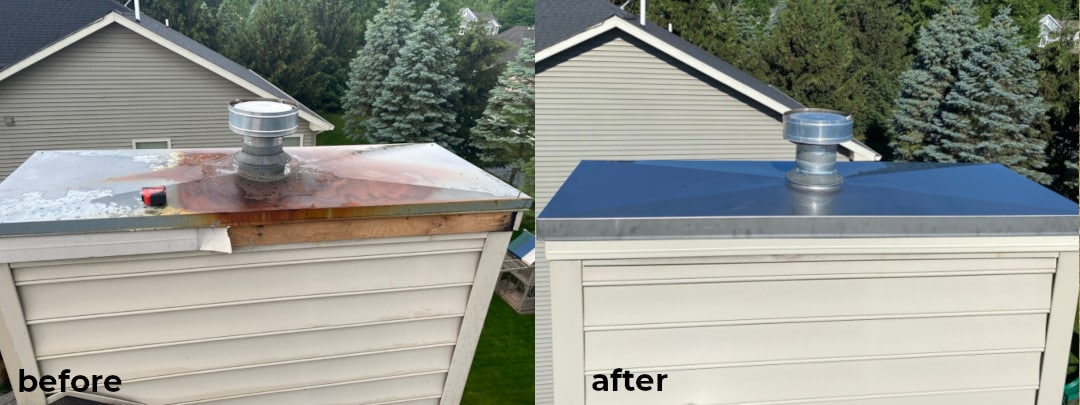
Find the location of a particular element. bare wood is located at coordinates (324, 233).